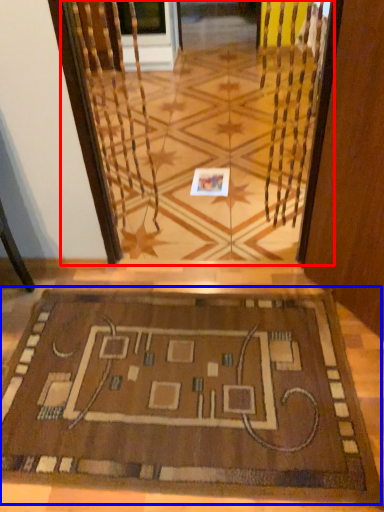
Question: Among these objects, which one is nearest to the camera, glass door (highlighted by a red box) or mat (highlighted by a blue box)?

Choices:
 (A) glass door
 (B) mat

Answer: (B)